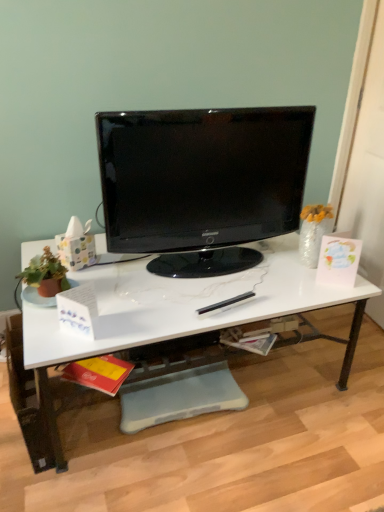
Locate an element on the screen. This screenshot has height=512, width=384. free point below black glossy monitor at center (from a real-world perspective) is located at coordinates (205, 263).